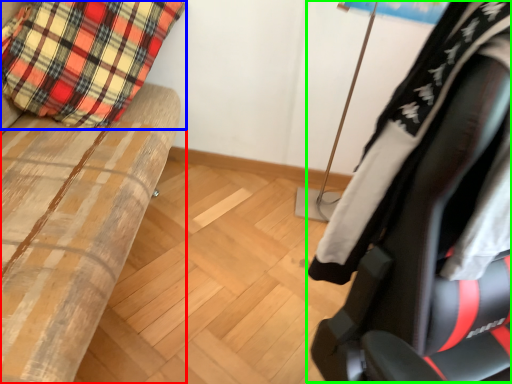
Question: Which object is the farthest from furniture (highlighted by a red box)? Choose among these: pillow (highlighted by a blue box) or chair (highlighted by a green box).

Choices:
 (A) pillow
 (B) chair

Answer: (B)